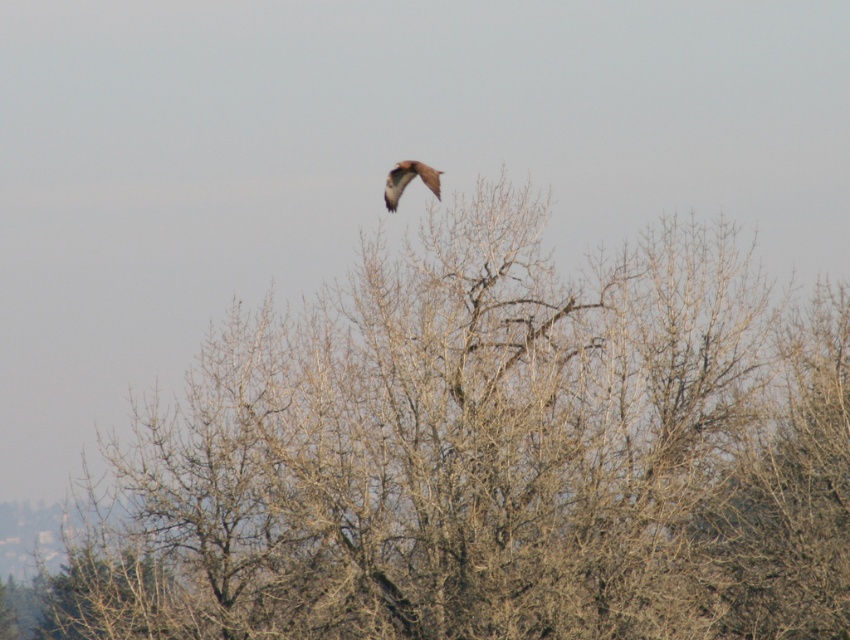
Question: Which of the following is the closest to the observer?

Choices:
 (A) (434, 188)
 (B) (468, 205)

Answer: (A)

Question: Is bare branches at center above brown feathered bird at upper center?

Choices:
 (A) yes
 (B) no

Answer: (B)

Question: Which point is closer to the camera taking this photo?

Choices:
 (A) (418, 172)
 (B) (734, 586)

Answer: (B)

Question: Does bare branches at center have a greater width compared to brown feathered bird at upper center?

Choices:
 (A) no
 (B) yes

Answer: (B)

Question: Is bare branches at center behind brown feathered bird at upper center?

Choices:
 (A) yes
 (B) no

Answer: (B)